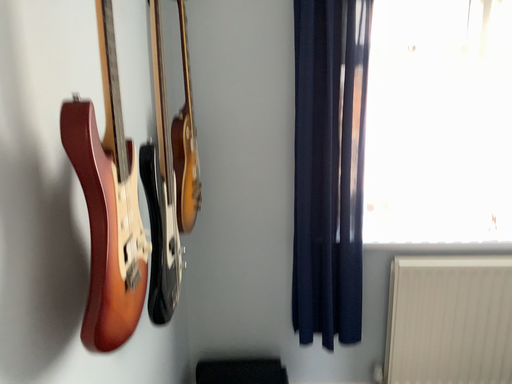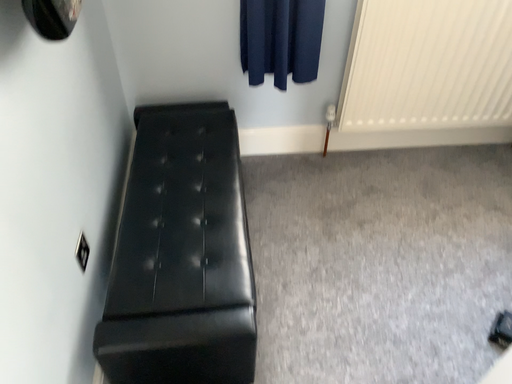
Question: How did the camera likely rotate when shooting the video?

Choices:
 (A) rotated upward
 (B) rotated downward

Answer: (B)